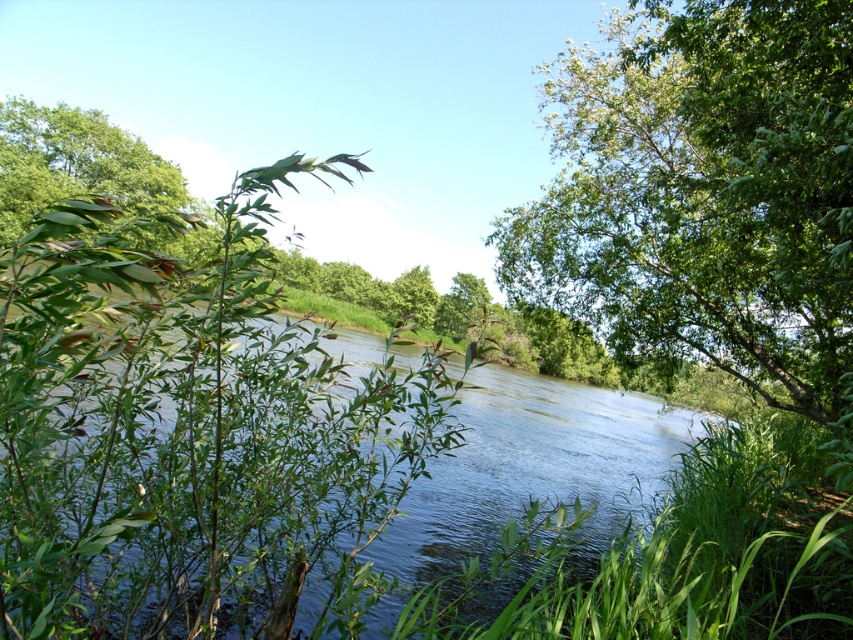
You are standing at the origin point in the scene. You see two points marked in the image. Which point is closer to you, point (x=303, y=572) or point (x=645, y=288)?

Point (x=303, y=572) is in front of point (x=645, y=288), so it is closer to you.

You are planning to plant a new tree in this area. The green leafy tree at center and the green leafy tree at upper left are already present. Which existing tree would require more space around it to avoid overcrowding?

The green leafy tree at upper left requires more space around it because it has a greater width compared to the green leafy tree at center.